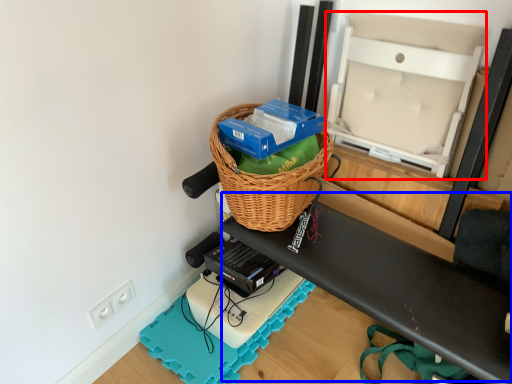
Question: Which object is further to the camera taking this photo, wide (highlighted by a red box) or wide (highlighted by a blue box)?

Choices:
 (A) wide
 (B) wide

Answer: (A)